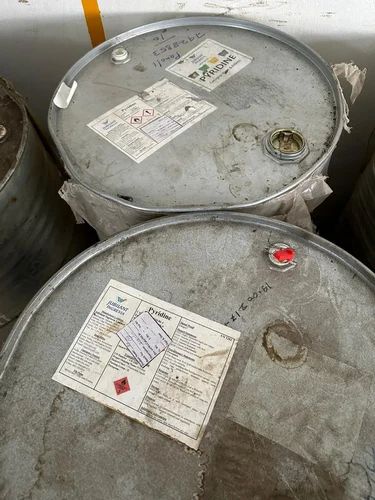
I want to click on sticker, so click(x=213, y=65).